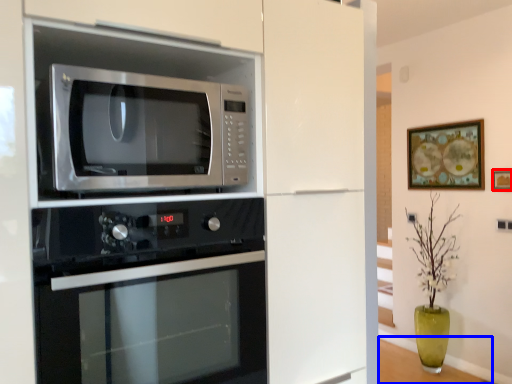
Question: Which of the following is the farthest to the observer, picture frame (highlighted by a red box) or table (highlighted by a blue box)?

Choices:
 (A) picture frame
 (B) table

Answer: (B)